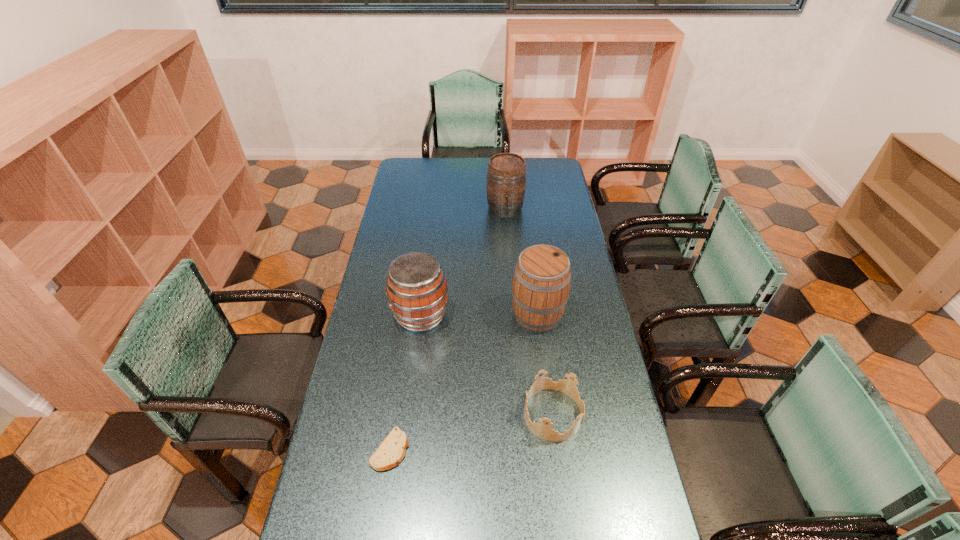
At what (x,y) coordinates should I click in order to perform the action: click on cider located at the left edge. Please return your answer as a coordinate pair (x, y). The height and width of the screenshot is (540, 960). Looking at the image, I should click on (416, 287).

You are a GUI agent. You are given a task and a screenshot of the screen. Output one action in this format:
    pyautogui.click(x=<x>, y=<y>)
    Task: Click on the pita bread that is at the left edge
    The image size is (960, 540).
    Given the screenshot: What is the action you would take?
    pyautogui.click(x=391, y=451)

Identify the location of cider at the right edge. This screenshot has width=960, height=540. (542, 277).

The width and height of the screenshot is (960, 540). I want to click on tiara at the right edge, so click(542, 430).

In the image, there is a desktop. Where is `vacant space at the far edge`? This screenshot has height=540, width=960. vacant space at the far edge is located at coordinates (456, 178).

This screenshot has width=960, height=540. What are the coordinates of `free region at the left edge of the desktop` in the screenshot? It's located at (343, 460).

In the image, there is a desktop. Where is `vacant region at the right edge`? The image size is (960, 540). vacant region at the right edge is located at coordinates (615, 379).

Where is `vacant space at the far left corner of the desktop`? The width and height of the screenshot is (960, 540). vacant space at the far left corner of the desktop is located at coordinates (403, 175).

In the image, there is a desktop. In order to click on vacant region at the far right corner in this screenshot , I will do `click(542, 170)`.

The image size is (960, 540). I want to click on vacant space that's between the tiara and the pita bread, so click(471, 432).